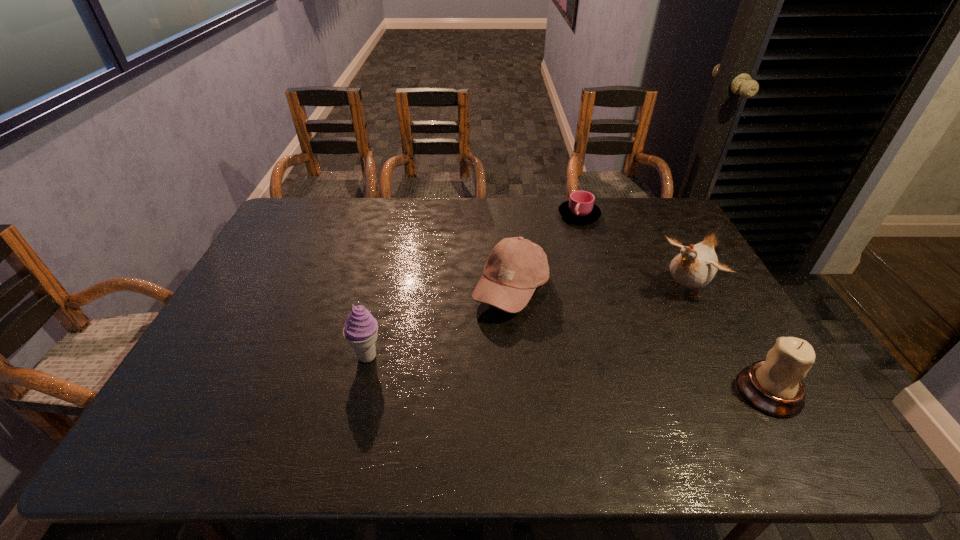
I want to click on the leftmost object, so click(x=361, y=329).

Identify the location of candle holder. The image size is (960, 540). (774, 386).

Where is `the shortest object`? the shortest object is located at coordinates (580, 208).

I want to click on cup, so click(580, 208).

Locate an element on the screen. The width and height of the screenshot is (960, 540). bird is located at coordinates (695, 266).

I want to click on the fourth object from right to left, so click(516, 266).

Where is `the fourth tallest object`? Image resolution: width=960 pixels, height=540 pixels. the fourth tallest object is located at coordinates (516, 266).

Image resolution: width=960 pixels, height=540 pixels. Identify the location of vacant space situated on the front of the leftmost object. (358, 394).

Locate an element on the screen. The image size is (960, 540). vacant space located on the left of the candle holder is located at coordinates (666, 392).

You are a GUI agent. You are given a task and a screenshot of the screen. Output one action in this format:
    pyautogui.click(x=<x>, y=<y>)
    Task: Click on the vacant space located 0.350m on the side with the handle of the cup
    This screenshot has height=540, width=960.
    Given the screenshot: What is the action you would take?
    pyautogui.click(x=582, y=294)